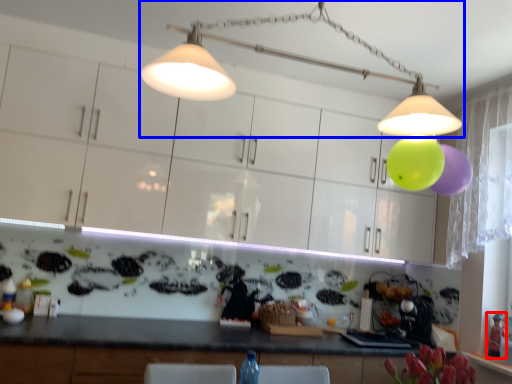
Question: Which point is further to the camera, toy (highlighted by a red box) or lamp (highlighted by a blue box)?

Choices:
 (A) toy
 (B) lamp

Answer: (A)